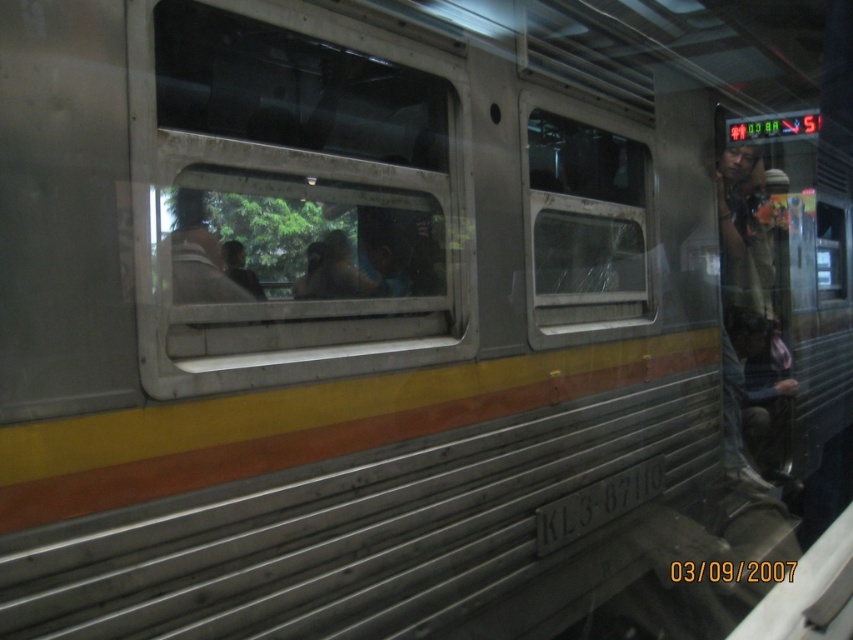
Question: Which is nearer to the matte brown jacket at center?

Choices:
 (A) clear glass window at center
 (B) transparent glass window at center

Answer: (A)

Question: Among these objects, which one is nearest to the camera?

Choices:
 (A) clear glass window at center
 (B) matte brown jacket at center

Answer: (A)

Question: From the image, what is the correct spatial relationship of clear glass window at center in relation to transparent glass window at center?

Choices:
 (A) below
 (B) above

Answer: (A)

Question: Considering the relative positions of clear glass window at center and transparent glass window at center in the image provided, where is clear glass window at center located with respect to transparent glass window at center?

Choices:
 (A) left
 (B) right

Answer: (A)

Question: Which point appears closest to the camera in this image?

Choices:
 (A) (592, 266)
 (B) (178, 252)
 (C) (248, 266)

Answer: (B)

Question: Considering the relative positions of clear glass window at center and matte brown jacket at center in the image provided, where is clear glass window at center located with respect to matte brown jacket at center?

Choices:
 (A) above
 (B) below

Answer: (A)